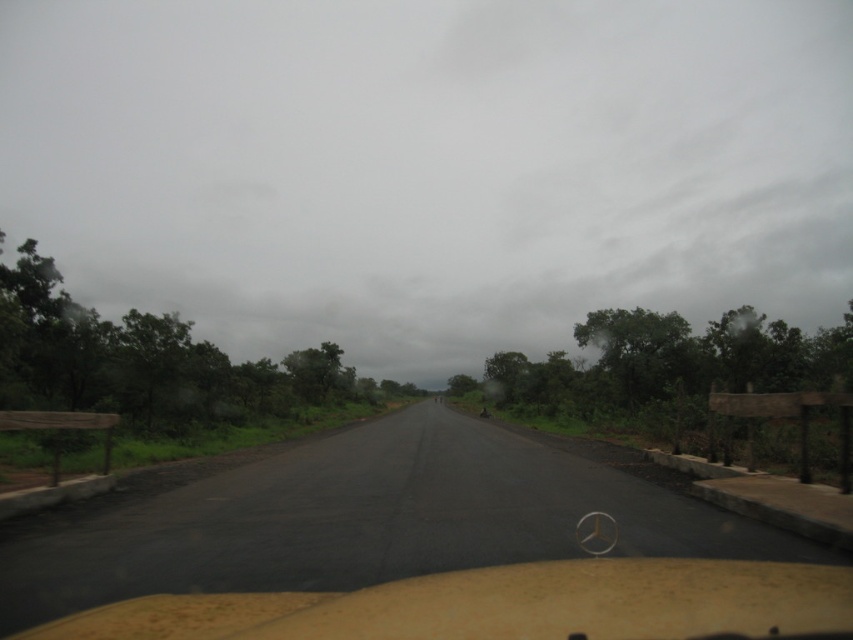
You are driving a Mercedes and see the yellow matte dashboard at center and the green leafy tree at left through the windshield. Which object is closer to you?

The yellow matte dashboard at center is closer to you because it is positioned to the right of the green leafy tree at left, which is further away.

You are driving a Mercedes Benz and want to check the distance between the yellow matte dashboard at center and the green leafy tree at left. Can you determine which one is closer to you based on their positions?

The yellow matte dashboard at center is closer to you because it is located below the green leafy tree at left, meaning it is in a lower position relative to your viewpoint inside the vehicle.

You are a passenger in a Mercedes Benz car and you look at the gray cloudy sky at upper center and the yellow matte dashboard at center. Which object is located to the left when viewed from your perspective?

The gray cloudy sky at upper center is positioned on the left side of the yellow matte dashboard at center, so it is located to the left when viewed from your perspective.